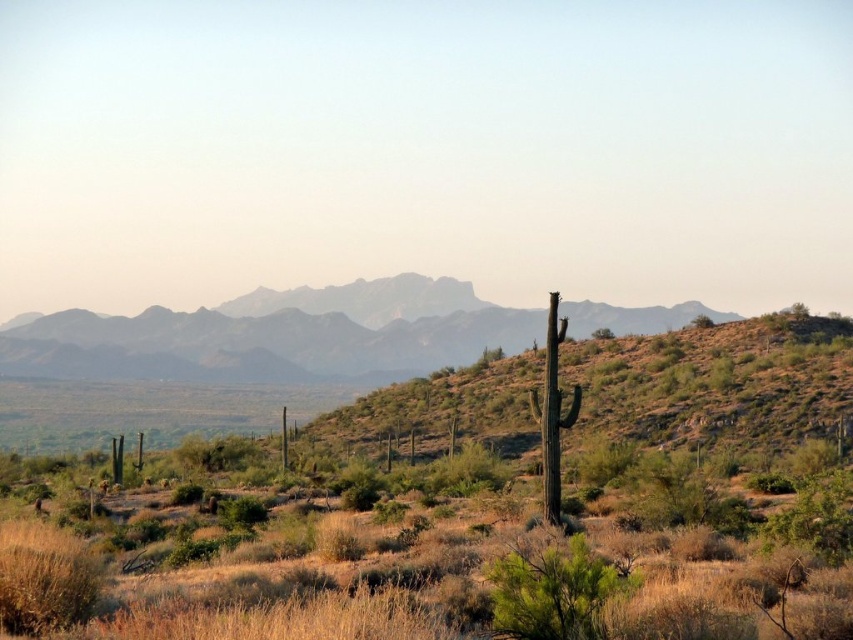
Can you confirm if green shrubbery at center is smaller than gray rocky mountain range at center?

Indeed, green shrubbery at center has a smaller size compared to gray rocky mountain range at center.

Does green shrubbery at center appear under gray rocky mountain range at center?

Yes, green shrubbery at center is below gray rocky mountain range at center.

In the scene shown: Who is more distant from viewer, (697,499) or (508,336)?

The point (508,336) is more distant.

You are a GUI agent. You are given a task and a screenshot of the screen. Output one action in this format:
    pyautogui.click(x=<x>, y=<y>)
    Task: Click on the green shrubbery at center
    The width and height of the screenshot is (853, 640).
    Given the screenshot: What is the action you would take?
    474,506